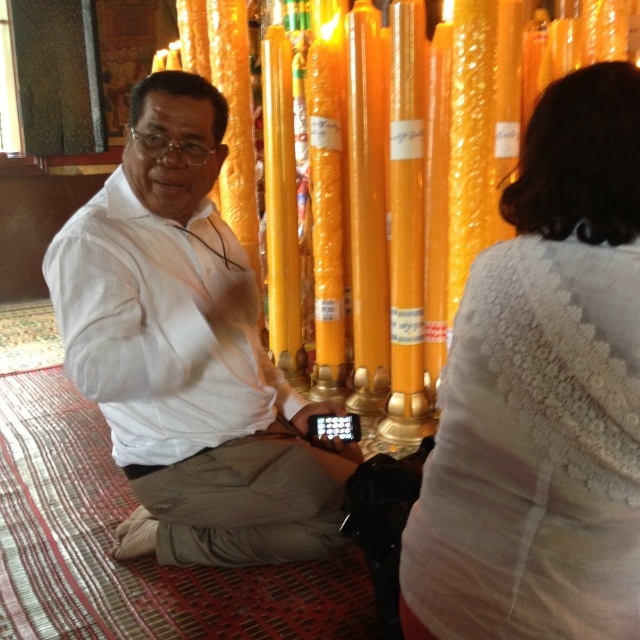
Is white lace sweater at upper right taller than white matte shirt at center?

No, white lace sweater at upper right is not taller than white matte shirt at center.

Is point (435, 445) behind point (205, 403)?

No, (435, 445) is closer to viewer.

What do you see at coordinates (541, 396) in the screenshot?
I see `white lace sweater at upper right` at bounding box center [541, 396].

Locate an element on the screen. The image size is (640, 640). white lace sweater at upper right is located at coordinates (541, 396).